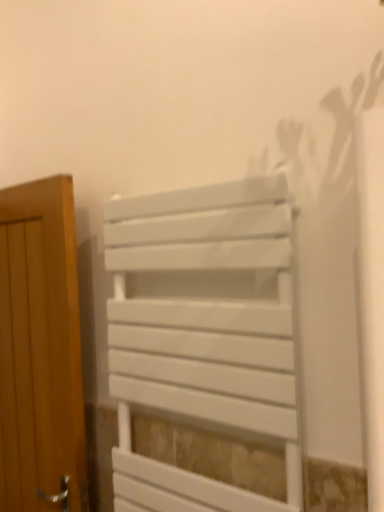
Question: From the image's perspective, is white matte radiator at center under wooden door at left?

Choices:
 (A) yes
 (B) no

Answer: (B)

Question: Could wooden door at left be considered to be inside white matte radiator at center?

Choices:
 (A) yes
 (B) no

Answer: (B)

Question: Does white matte radiator at center come in front of wooden door at left?

Choices:
 (A) yes
 (B) no

Answer: (A)

Question: Can you confirm if white matte radiator at center is wider than wooden door at left?

Choices:
 (A) yes
 (B) no

Answer: (B)

Question: Considering the relative positions of white matte radiator at center and wooden door at left in the image provided, is white matte radiator at center to the left of wooden door at left from the viewer's perspective?

Choices:
 (A) no
 (B) yes

Answer: (A)

Question: Is the depth of white matte radiator at center greater than that of wooden door at left?

Choices:
 (A) yes
 (B) no

Answer: (B)

Question: From the image's perspective, would you say wooden door at left is shown under white matte radiator at center?

Choices:
 (A) yes
 (B) no

Answer: (A)

Question: Is white matte radiator at center at the back of wooden door at left?

Choices:
 (A) yes
 (B) no

Answer: (B)

Question: Is wooden door at left directly adjacent to white matte radiator at center?

Choices:
 (A) no
 (B) yes

Answer: (A)

Question: Does wooden door at left lie in front of white matte radiator at center?

Choices:
 (A) no
 (B) yes

Answer: (A)

Question: From the image's perspective, is wooden door at left over white matte radiator at center?

Choices:
 (A) yes
 (B) no

Answer: (B)

Question: Are wooden door at left and white matte radiator at center far apart?

Choices:
 (A) yes
 (B) no

Answer: (B)

Question: From the image's perspective, is white matte radiator at center above or below wooden door at left?

Choices:
 (A) below
 (B) above

Answer: (B)